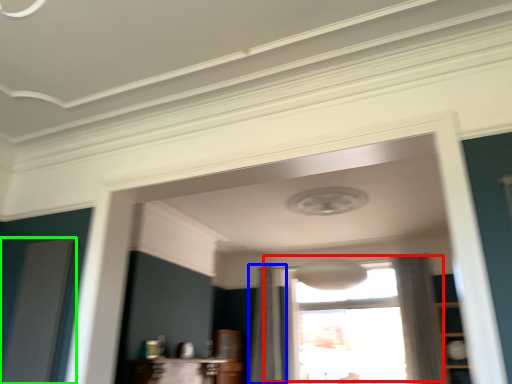
Question: Considering the real-world distances, which object is farthest from window (highlighted by a red box)? curtain (highlighted by a blue box) or screen door (highlighted by a green box)?

Choices:
 (A) curtain
 (B) screen door

Answer: (B)